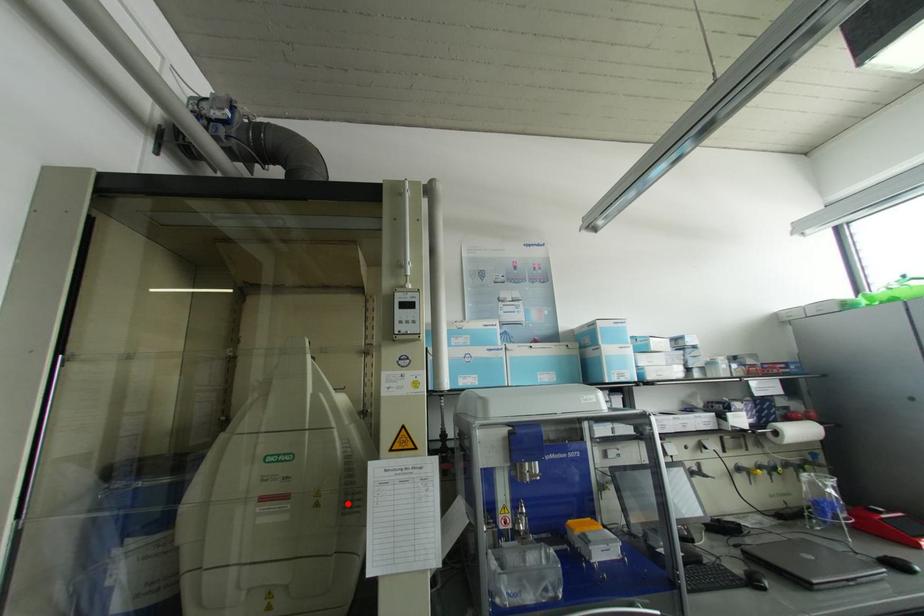
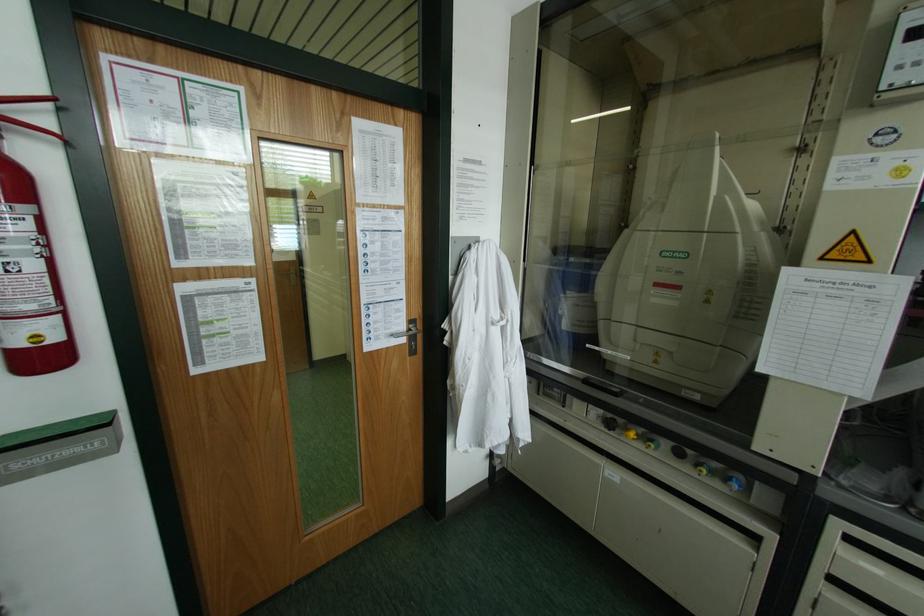
Find the pixel in the second image that matches the highlighted location in the first image.

(743, 310)